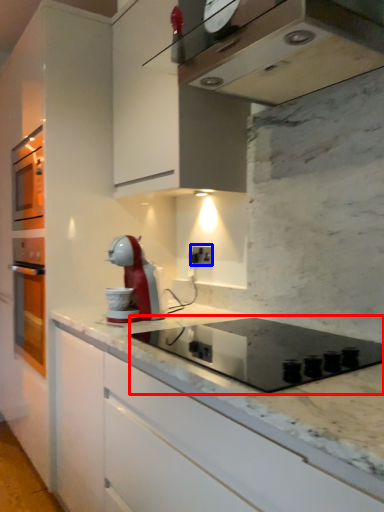
Question: Which object is closer to the camera taking this photo, appliance (highlighted by a red box) or electric outlet (highlighted by a blue box)?

Choices:
 (A) appliance
 (B) electric outlet

Answer: (A)